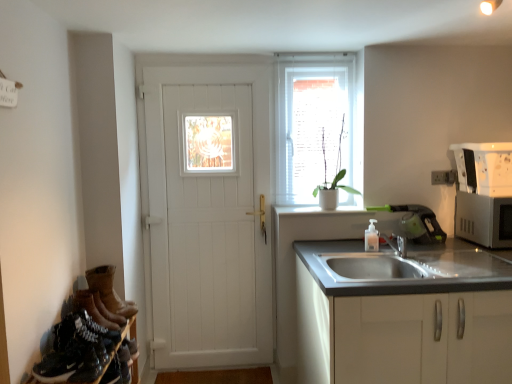
Find the location of `vacant space underneath white wooden door at center (from a real-world perspective)`. vacant space underneath white wooden door at center (from a real-world perspective) is located at coordinates (219, 361).